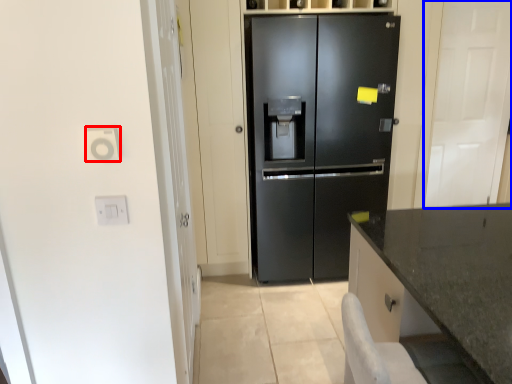
Question: Which object appears closest to the camera in this image, electric outlet (highlighted by a red box) or glass door (highlighted by a blue box)?

Choices:
 (A) electric outlet
 (B) glass door

Answer: (A)